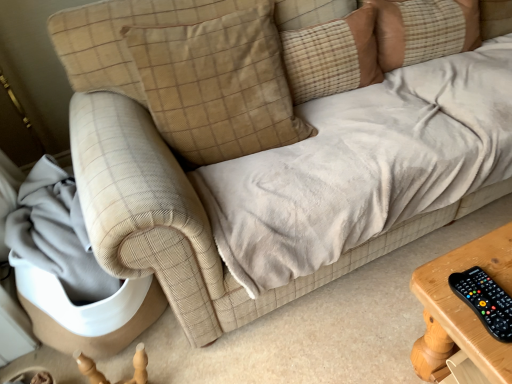
Question: From the image's perspective, relative to brown plaid pillow at upper center, the second pillow from the right, is beige corduroy pillow at upper center, the third pillow viewed from the left, above or below?

Choices:
 (A) below
 (B) above

Answer: (B)

Question: In the image, is beige corduroy pillow at upper center, the third pillow viewed from the left, on the left side or the right side of brown plaid pillow at upper center, the second pillow in the left-to-right sequence?

Choices:
 (A) right
 (B) left

Answer: (A)

Question: Based on their relative distances, which object is farther from the black plastic remote at lower right?

Choices:
 (A) brown plaid pillow at upper center, the second pillow in the left-to-right sequence
 (B) beige corduroy pillow at upper center, the third pillow viewed from the left
 (C) beige corduroy pillow at upper center, marked as the first pillow in a left-to-right arrangement

Answer: (B)

Question: Considering the real-world distances, which object is closest to the beige corduroy pillow at upper center, the third pillow viewed from the left?

Choices:
 (A) beige corduroy pillow at upper center, the third pillow when ordered from right to left
 (B) black plastic remote at lower right
 (C) brown plaid pillow at upper center, the second pillow in the left-to-right sequence

Answer: (C)